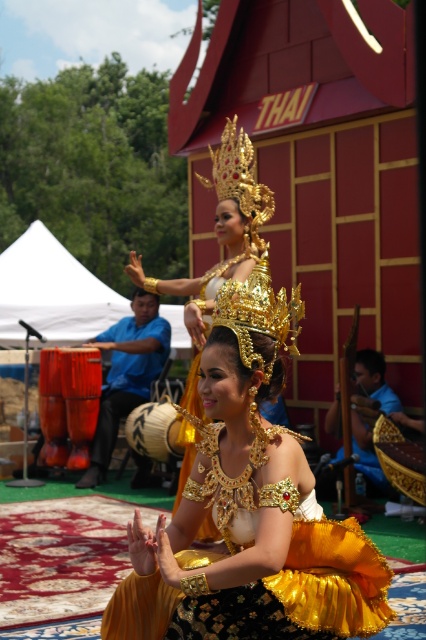
Question: Which point appears farthest from the camera in this image?

Choices:
 (A) (291, 340)
 (B) (147, 285)

Answer: (B)

Question: Is golden silk dress at center above gold metallic headdress at center?

Choices:
 (A) no
 (B) yes

Answer: (A)

Question: Is golden silk dress at center to the right of gold metallic headdress at center from the viewer's perspective?

Choices:
 (A) no
 (B) yes

Answer: (B)

Question: Does golden silk dress at center have a larger size compared to gold metallic headdress at center?

Choices:
 (A) yes
 (B) no

Answer: (B)